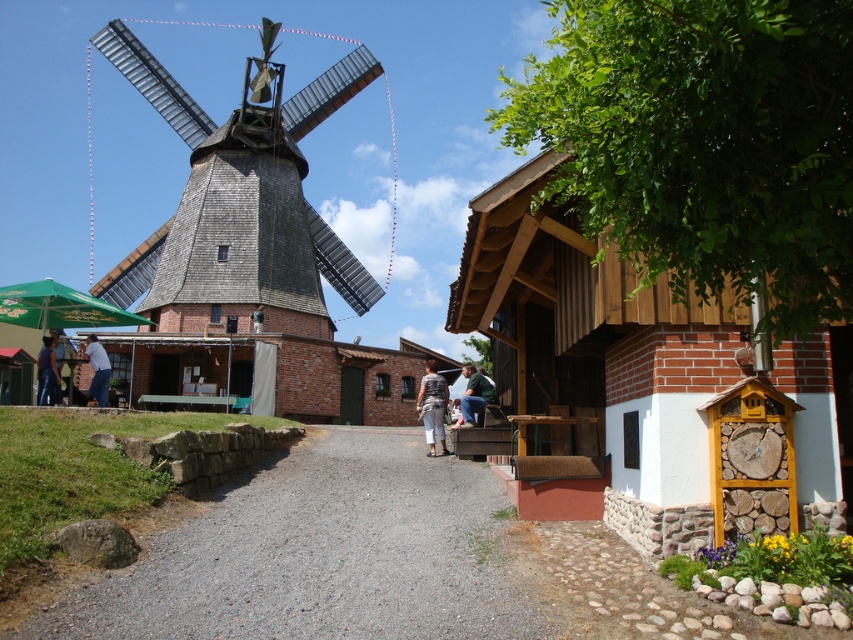
Question: Which of the following is the closest to the observer?

Choices:
 (A) gray gravel path at center
 (B) green painted wood picnic table at center
 (C) green fabric jacket at center
 (D) striped fabric shirt at center

Answer: (A)

Question: Is gray gravel path at center wider than green fabric jacket at center?

Choices:
 (A) yes
 (B) no

Answer: (A)

Question: Is gray gravel path at center wider than green fabric jacket at center?

Choices:
 (A) yes
 (B) no

Answer: (A)

Question: From the image, what is the correct spatial relationship of green fabric jacket at center in relation to white shirt at center?

Choices:
 (A) above
 (B) below

Answer: (B)

Question: Which object is farther from the camera taking this photo?

Choices:
 (A) gray gravel path at center
 (B) green fabric jacket at center

Answer: (B)

Question: Based on their relative distances, which object is farther from the green painted wood picnic table at center?

Choices:
 (A) dark blue jeans at lower left
 (B) wooden shingles windmill at left
 (C) white shirt at center

Answer: (B)